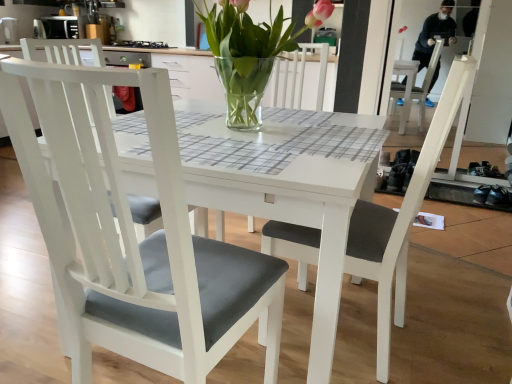
The height and width of the screenshot is (384, 512). What do you see at coordinates (400, 221) in the screenshot?
I see `matte gray cushioned chair at center, arranged as the first chair when viewed from the right` at bounding box center [400, 221].

This screenshot has width=512, height=384. What do you see at coordinates (250, 53) in the screenshot?
I see `clear glass vase at center` at bounding box center [250, 53].

Where is `white matte chair at left, which is the 1th chair in left-to-right order`? white matte chair at left, which is the 1th chair in left-to-right order is located at coordinates (131, 235).

From a real-world perspective, is matte gray cushioned chair at center, arranged as the first chair when viewed from the right, physically located above or below clear glass vase at center?

matte gray cushioned chair at center, arranged as the first chair when viewed from the right, is situated lower than clear glass vase at center in the real world.

Is matte gray cushioned chair at center, acting as the second chair starting from the left, taller than clear glass vase at center?

Yes.

Is matte gray cushioned chair at center, acting as the second chair starting from the left, not near clear glass vase at center?

No, there isn't a large distance between matte gray cushioned chair at center, acting as the second chair starting from the left, and clear glass vase at center.

Who is more distant, clear glass vase at center or white matte chair at left, which is the 1th chair in left-to-right order?

Positioned behind is clear glass vase at center.

Can white matte chair at left, which is the 1th chair in left-to-right order, be found inside clear glass vase at center?

No, white matte chair at left, which is the 1th chair in left-to-right order, is not inside clear glass vase at center.

Measure the distance between clear glass vase at center and white matte chair at left, which is the 1th chair in left-to-right order.

clear glass vase at center and white matte chair at left, which is the 1th chair in left-to-right order, are 25.96 inches apart.

Which point is more distant from viewer, (257, 35) or (66, 232)?

The point (257, 35) is farther.

Is the position of white matte chair at left, the second chair when ordered from right to left, less distant than that of matte gray cushioned chair at center, acting as the second chair starting from the left?

Yes, the depth of white matte chair at left, the second chair when ordered from right to left, is less than that of matte gray cushioned chair at center, acting as the second chair starting from the left.

From the picture: How many degrees apart are the facing directions of white matte chair at left, which is the 1th chair in left-to-right order, and matte gray cushioned chair at center, arranged as the first chair when viewed from the right?

5.62 degrees separate the facing orientations of white matte chair at left, which is the 1th chair in left-to-right order, and matte gray cushioned chair at center, arranged as the first chair when viewed from the right.

Is white matte chair at left, which is the 1th chair in left-to-right order, turned away from matte gray cushioned chair at center, arranged as the first chair when viewed from the right?

Yes, white matte chair at left, which is the 1th chair in left-to-right order, is positioned with its back facing matte gray cushioned chair at center, arranged as the first chair when viewed from the right.

From the image's perspective, which is below, clear glass vase at center or matte gray cushioned chair at center, arranged as the first chair when viewed from the right?

matte gray cushioned chair at center, arranged as the first chair when viewed from the right.

Based on their positions, is clear glass vase at center located to the left or right of matte gray cushioned chair at center, acting as the second chair starting from the left?

clear glass vase at center is to the left of matte gray cushioned chair at center, acting as the second chair starting from the left.

Is clear glass vase at center oriented away from matte gray cushioned chair at center, acting as the second chair starting from the left?

Absolutely, clear glass vase at center is directed away from matte gray cushioned chair at center, acting as the second chair starting from the left.

Locate an element on the screen. The height and width of the screenshot is (384, 512). houseplant positioned vertically above the matte gray cushioned chair at center, arranged as the first chair when viewed from the right (from a real-world perspective) is located at coordinates (250, 53).

Which of these two, white matte chair at left, which is the 1th chair in left-to-right order, or clear glass vase at center, is bigger?

Bigger between the two is white matte chair at left, which is the 1th chair in left-to-right order.

How distant is white matte chair at left, which is the 1th chair in left-to-right order, from clear glass vase at center?

A distance of 25.96 inches exists between white matte chair at left, which is the 1th chair in left-to-right order, and clear glass vase at center.

Considering the sizes of objects white matte chair at left, the second chair when ordered from right to left, and clear glass vase at center in the image provided, who is shorter, white matte chair at left, the second chair when ordered from right to left, or clear glass vase at center?

Standing shorter between the two is clear glass vase at center.

Is white matte chair at left, the second chair when ordered from right to left, positioned with its back to clear glass vase at center?

white matte chair at left, the second chair when ordered from right to left, is not turned away from clear glass vase at center.

Does matte gray cushioned chair at center, arranged as the first chair when viewed from the right, contain white matte chair at left, the second chair when ordered from right to left?

No, white matte chair at left, the second chair when ordered from right to left, is not surrounded by matte gray cushioned chair at center, arranged as the first chair when viewed from the right.

Locate an element on the screen. This screenshot has width=512, height=384. chair below the matte gray cushioned chair at center, acting as the second chair starting from the left (from a real-world perspective) is located at coordinates (131, 235).

Between matte gray cushioned chair at center, acting as the second chair starting from the left, and white matte chair at left, which is the 1th chair in left-to-right order, which one has less height?

white matte chair at left, which is the 1th chair in left-to-right order, is shorter.

Considering the relative positions of matte gray cushioned chair at center, arranged as the first chair when viewed from the right, and white matte chair at left, which is the 1th chair in left-to-right order, in the image provided, is matte gray cushioned chair at center, arranged as the first chair when viewed from the right, to the left of white matte chair at left, which is the 1th chair in left-to-right order, from the viewer's perspective?

No, matte gray cushioned chair at center, arranged as the first chair when viewed from the right, is not to the left of white matte chair at left, which is the 1th chair in left-to-right order.

Where is `chair that is the 1st one when counting downward from the clear glass vase at center (from the image's perspective)`? Image resolution: width=512 pixels, height=384 pixels. chair that is the 1st one when counting downward from the clear glass vase at center (from the image's perspective) is located at coordinates (400, 221).

I want to click on houseplant located above the white matte chair at left, the second chair when ordered from right to left (from the image's perspective), so tap(250, 53).

Looking at the image, which one is located closer to matte gray cushioned chair at center, acting as the second chair starting from the left, white matte chair at left, which is the 1th chair in left-to-right order, or clear glass vase at center?

The object closer to matte gray cushioned chair at center, acting as the second chair starting from the left, is white matte chair at left, which is the 1th chair in left-to-right order.

Based on their spatial positions, is matte gray cushioned chair at center, acting as the second chair starting from the left, or white matte chair at left, the second chair when ordered from right to left, further from clear glass vase at center?

Among the two, white matte chair at left, the second chair when ordered from right to left, is located further to clear glass vase at center.

Looking at the image, which one is located further to clear glass vase at center, white matte chair at left, which is the 1th chair in left-to-right order, or matte gray cushioned chair at center, acting as the second chair starting from the left?

Among the two, white matte chair at left, which is the 1th chair in left-to-right order, is located further to clear glass vase at center.

Which object lies nearer to the anchor point white matte chair at left, which is the 1th chair in left-to-right order, clear glass vase at center or matte gray cushioned chair at center, acting as the second chair starting from the left?

matte gray cushioned chair at center, acting as the second chair starting from the left.

From the picture: When comparing their distances from white matte chair at left, which is the 1th chair in left-to-right order, does matte gray cushioned chair at center, acting as the second chair starting from the left, or clear glass vase at center seem closer?

matte gray cushioned chair at center, acting as the second chair starting from the left, is positioned closer to the anchor white matte chair at left, which is the 1th chair in left-to-right order.

Based on their spatial positions, is clear glass vase at center or white matte chair at left, the second chair when ordered from right to left, further from matte gray cushioned chair at center, arranged as the first chair when viewed from the right?

clear glass vase at center lies further to matte gray cushioned chair at center, arranged as the first chair when viewed from the right, than the other object.

In order to click on chair between clear glass vase at center and white matte chair at left, the second chair when ordered from right to left, vertically in this screenshot , I will do `click(400, 221)`.